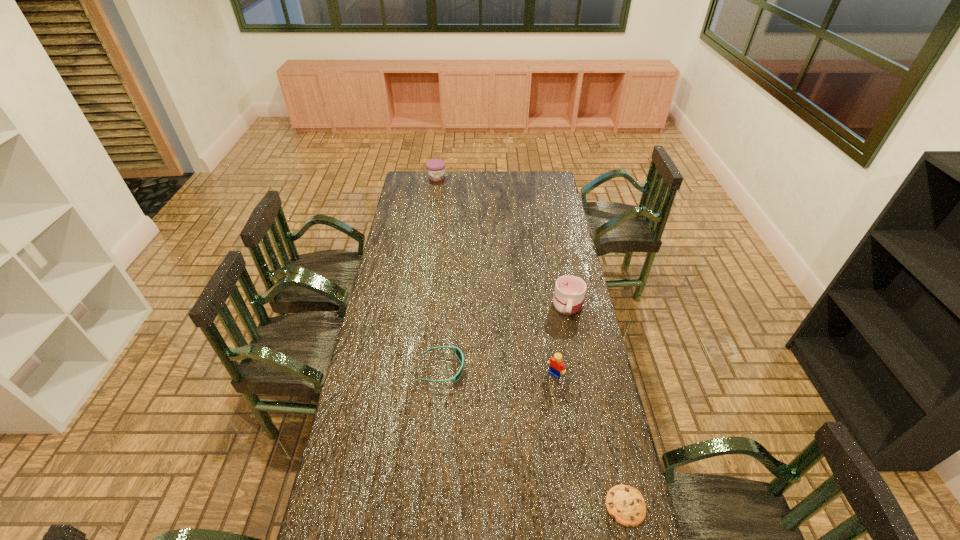
Image resolution: width=960 pixels, height=540 pixels. In order to click on vacant space that is in between the third object from right to left and the sunglasses in this screenshot , I will do `click(498, 372)`.

You are a GUI agent. You are given a task and a screenshot of the screen. Output one action in this format:
    pyautogui.click(x=<x>, y=<y>)
    Task: Click on the free space between the third object from left to right and the fourth nearest object
    The height and width of the screenshot is (540, 960).
    Given the screenshot: What is the action you would take?
    pyautogui.click(x=562, y=340)

Where is `vacant space that is in between the sunglasses and the mug`? vacant space that is in between the sunglasses and the mug is located at coordinates (505, 337).

The height and width of the screenshot is (540, 960). In order to click on free area in between the farthest object and the third object from right to left in this screenshot , I will do `click(495, 276)`.

Where is `unoccupied area between the jam and the second farthest object`? unoccupied area between the jam and the second farthest object is located at coordinates (502, 241).

Where is `free area in between the cookie and the fourth tallest object`? This screenshot has width=960, height=540. free area in between the cookie and the fourth tallest object is located at coordinates (534, 437).

Identify the location of unoccupied area between the fourth tallest object and the cookie. The width and height of the screenshot is (960, 540). (534, 437).

This screenshot has width=960, height=540. In order to click on unoccupied position between the nearest object and the jam in this screenshot , I will do `click(531, 342)`.

The height and width of the screenshot is (540, 960). I want to click on object that is the closest to the jam, so click(569, 293).

Locate an element on the screen. This screenshot has width=960, height=540. the third closest object to the cookie is located at coordinates (569, 293).